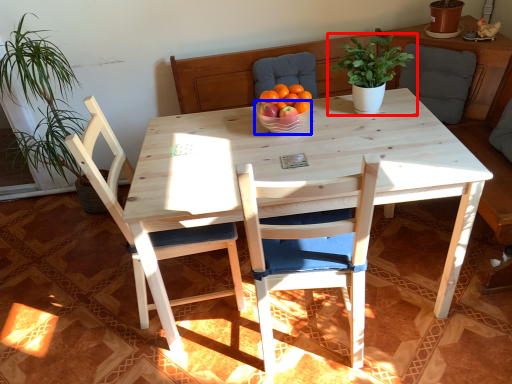
Question: Which of the following is the farthest to the observer, houseplant (highlighted by a red box) or bowl (highlighted by a blue box)?

Choices:
 (A) houseplant
 (B) bowl

Answer: (B)